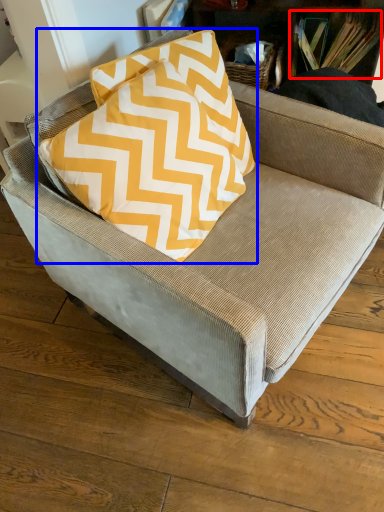
Question: Which point is further to the camera, book (highlighted by a red box) or pillow (highlighted by a blue box)?

Choices:
 (A) book
 (B) pillow

Answer: (A)